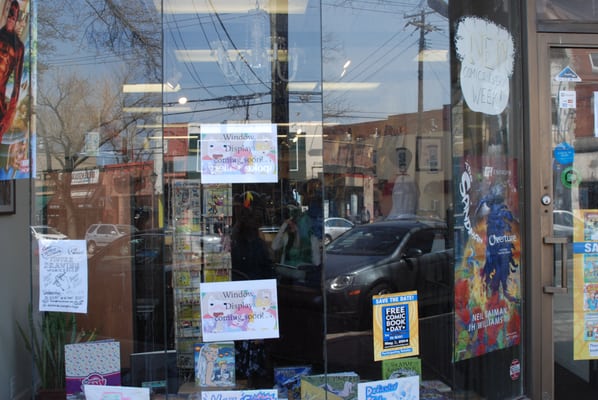
You are a GUI agent. You are given a task and a screenshot of the screen. Output one action in this format:
    pyautogui.click(x=<x>, y=<y>)
    Task: Click on the lock
    This screenshot has width=598, height=400.
    Given the screenshot: What is the action you would take?
    pyautogui.click(x=547, y=199)